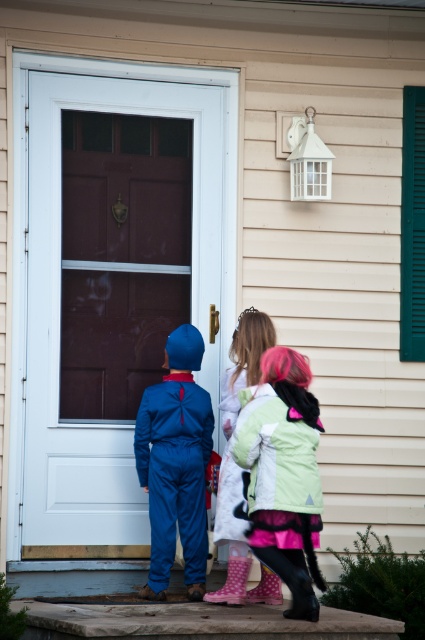
You are a delivery person holding a package that requires a 32 inch clearance to deliver. You see the matte brown screen door at center and the light pink polka dot boots at center. Can you fit the package between them?

The matte brown screen door at center and the light pink polka dot boots at center are 31.90 inches apart, which is slightly less than the required 32 inch clearance. Therefore, the package cannot fit between them.

You are a parent trying to open the matte brown screen door at center to let the children inside. Considering the height of the door and the blue matte jumpsuit at center, can you reach the door handle without bending down?

The matte brown screen door at center is taller than the blue matte jumpsuit at center. Since the door is higher, the handle is likely at a reachable height for an adult, so you can open the door without bending down.